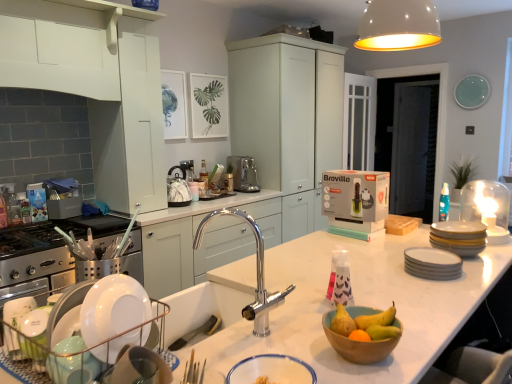
Question: Can you confirm if matte white cabinets at center, which is counted as the 3th cabinetry, starting from the left, is smaller than yellow matte plates at right, the first appliance positioned from the top?

Choices:
 (A) yes
 (B) no

Answer: (B)

Question: Is yellow matte plates at right, positioned as the 1th appliance in right-to-left order, located within matte white cabinets at center, which is the third cabinetry from front to back?

Choices:
 (A) yes
 (B) no

Answer: (B)

Question: Is matte white cabinets at center, which is the third cabinetry from front to back, to the right of yellow matte plates at right, the second appliance when ordered from front to back, from the viewer's perspective?

Choices:
 (A) no
 (B) yes

Answer: (A)

Question: From the image's perspective, is matte white cabinets at center, which is the third cabinetry from front to back, under yellow matte plates at right, placed as the 2th appliance when sorted from bottom to top?

Choices:
 (A) no
 (B) yes

Answer: (A)

Question: Considering the relative sizes of matte white cabinets at center, which is the third cabinetry from front to back, and yellow matte plates at right, placed as the 2th appliance when sorted from bottom to top, in the image provided, is matte white cabinets at center, which is the third cabinetry from front to back, thinner than yellow matte plates at right, placed as the 2th appliance when sorted from bottom to top,?

Choices:
 (A) yes
 (B) no

Answer: (B)

Question: Visually, is wooden bowl at center, marked as the second basin in a left-to-right arrangement, positioned to the left or to the right of white glossy bowl at lower center, the 1th basin when ordered from front to back?

Choices:
 (A) left
 (B) right

Answer: (B)

Question: Considering the positions of wooden bowl at center, arranged as the second basin when viewed from the front, and white glossy bowl at lower center, placed as the second basin when sorted from back to front, in the image, is wooden bowl at center, arranged as the second basin when viewed from the front, bigger or smaller than white glossy bowl at lower center, placed as the second basin when sorted from back to front,?

Choices:
 (A) small
 (B) big

Answer: (B)

Question: From a real-world perspective, is wooden bowl at center, which is the first basin from back to front, physically located above or below white glossy bowl at lower center, placed as the second basin when sorted from back to front?

Choices:
 (A) above
 (B) below

Answer: (B)

Question: In the image, is wooden bowl at center, which ranks as the 1th basin in right-to-left order, positioned in front of or behind white glossy bowl at lower center, the 1th basin when ordered from front to back?

Choices:
 (A) behind
 (B) front

Answer: (A)

Question: From a real-world perspective, is metallic silverware at lower center positioned above or below translucent plastic bottle at left?

Choices:
 (A) below
 (B) above

Answer: (A)

Question: Considering the relative positions of metallic silverware at lower center and translucent plastic bottle at left in the image provided, is metallic silverware at lower center to the left or to the right of translucent plastic bottle at left?

Choices:
 (A) left
 (B) right

Answer: (B)

Question: Considering the positions of metallic silverware at lower center and translucent plastic bottle at left in the image, is metallic silverware at lower center wider or thinner than translucent plastic bottle at left?

Choices:
 (A) wide
 (B) thin

Answer: (B)

Question: From the image's perspective, is metallic silverware at lower center above or below translucent plastic bottle at left?

Choices:
 (A) below
 (B) above

Answer: (A)

Question: Is matte white cabinets at center, which is counted as the 3th cabinetry, starting from the left, in front of or behind white matte light fixture at upper center in the image?

Choices:
 (A) behind
 (B) front

Answer: (A)

Question: In the image, is matte white cabinets at center, which is the third cabinetry from front to back, on the left side or the right side of white matte light fixture at upper center?

Choices:
 (A) left
 (B) right

Answer: (A)